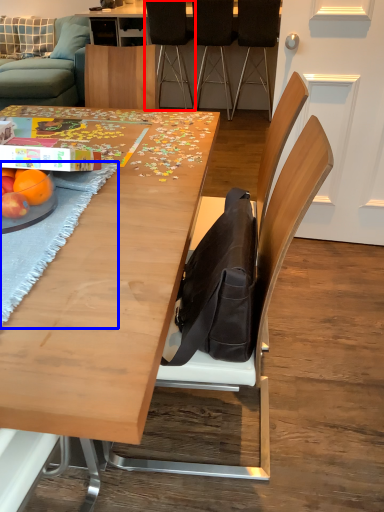
Question: Which of the following is the farthest to the observer, chair (highlighted by a red box) or place mat (highlighted by a blue box)?

Choices:
 (A) chair
 (B) place mat

Answer: (A)